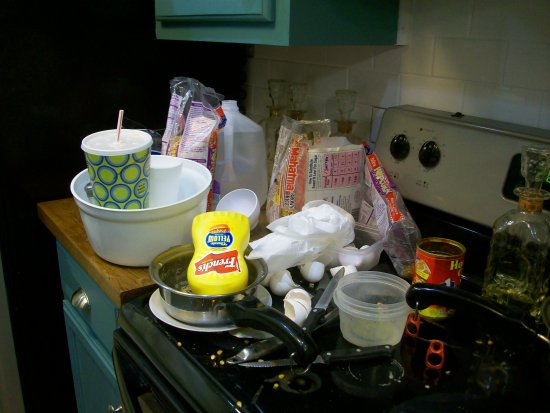
The height and width of the screenshot is (413, 550). In order to click on green drink cup in this screenshot , I will do `click(129, 170)`.